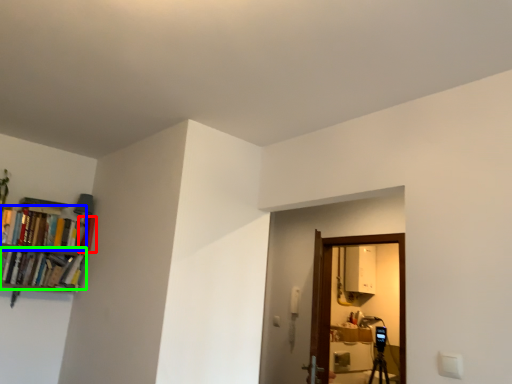
Question: Which object is positioned farthest from book (highlighted by a red box)? Select from book (highlighted by a blue box) and book (highlighted by a green box).

Choices:
 (A) book
 (B) book

Answer: (B)